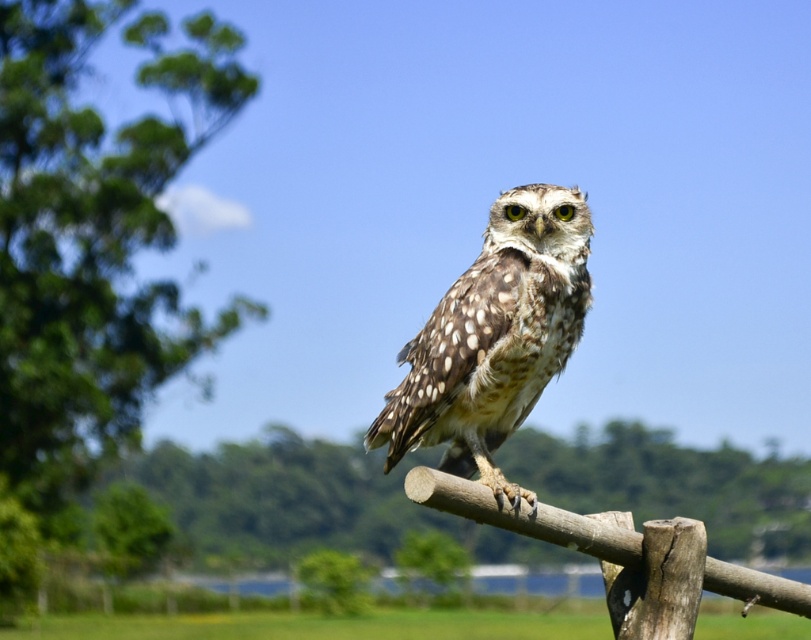
You are a birdwatcher observing the speckled feathered owl at center and the brown rough wood at center. Which object is positioned higher in the image?

The speckled feathered owl at center is above the brown rough wood at center, so it is positioned higher in the image.

You are a bird flying over a rural area and spot the green leafy tree at upper left and the brown rough wood at center. Which object is higher in the sky?

The green leafy tree at upper left is higher in the sky than the brown rough wood at center because it is positioned above it.